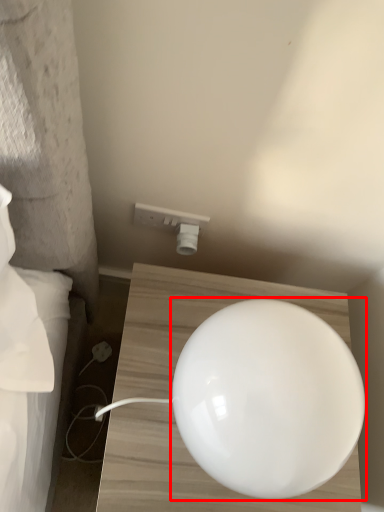
Question: From the image's perspective, where is lamp (annotated by the red box) located in relation to electric outlet in the image?

Choices:
 (A) above
 (B) below

Answer: (B)